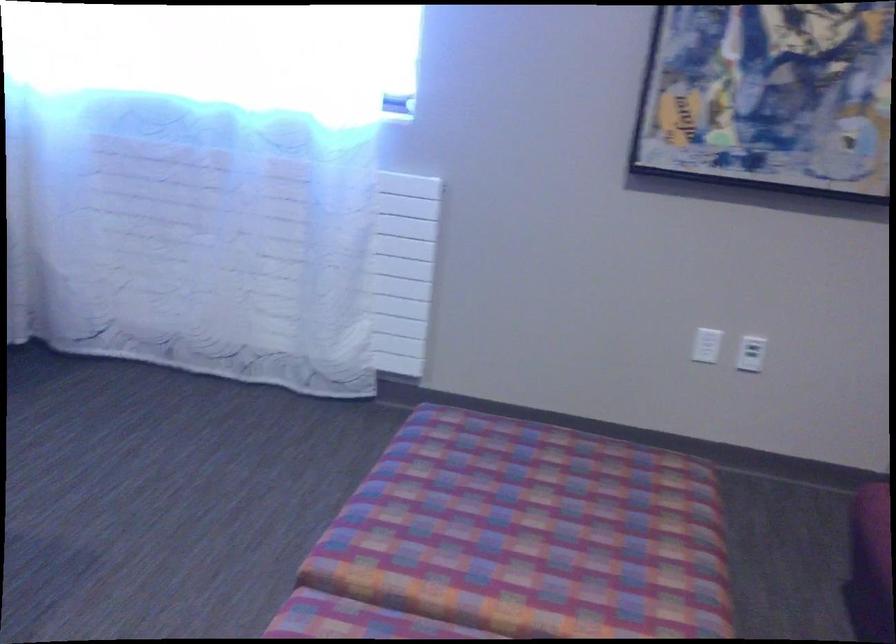
Find where to sit the sofa sitting surface. Please return your answer as a coordinate pair (x, y).

(550, 516)